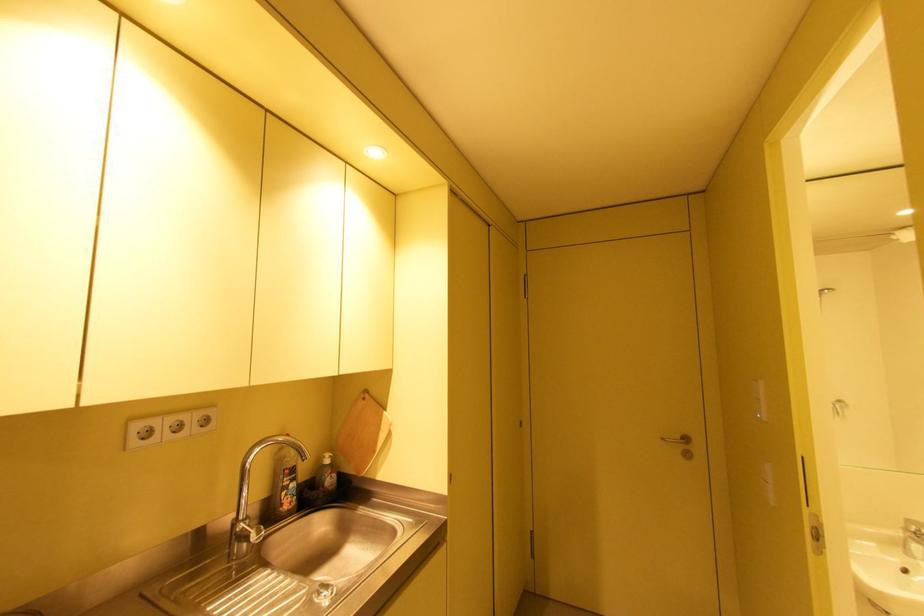
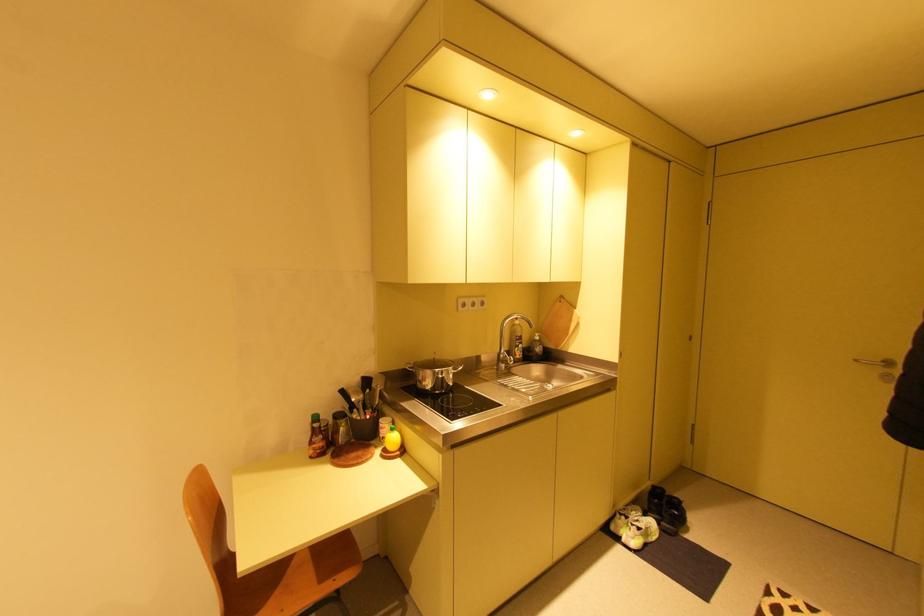
The point at (669, 439) is marked in the first image. Where is the corresponding point in the second image?

(861, 361)